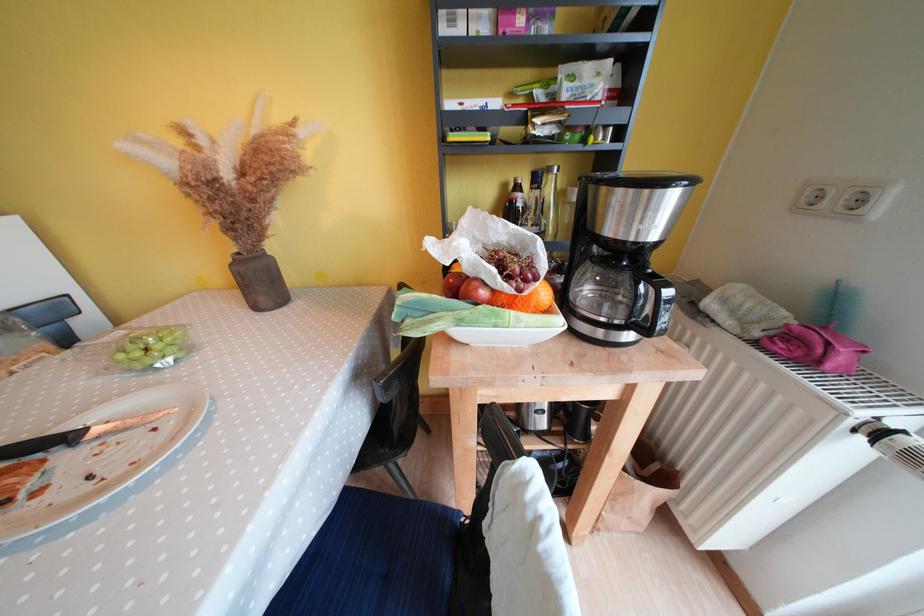
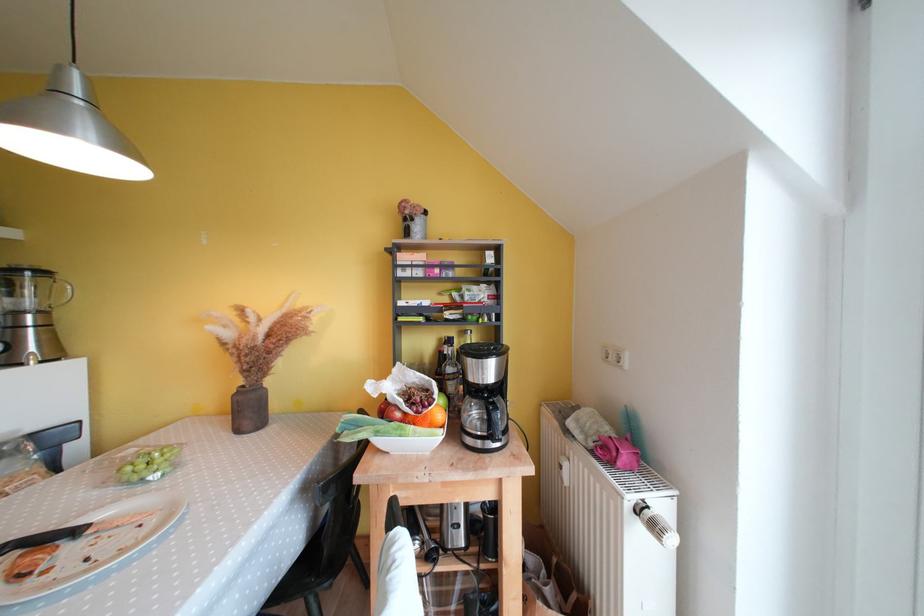
The point at (761, 347) is marked in the first image. Where is the corresponding point in the second image?

(599, 456)